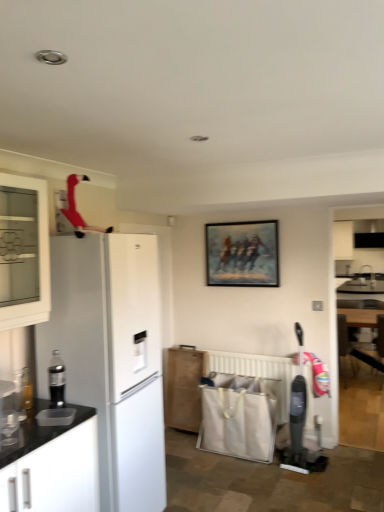
Describe the element at coordinates (183, 388) in the screenshot. I see `wooden cabinet at lower center, positioned as the second cabinetry in top-to-bottom order` at that location.

I want to click on black plastic soda dispenser at left, so click(56, 380).

Identify the location of wooden armchair at lower right. The image size is (384, 512). [353, 347].

What is the approximate width of white plastic radiator at lower center?

It is 1.45 inches.

What is the approximate width of white matte refrigerator at left?

white matte refrigerator at left is 26.10 inches in width.

In order to click on wooden cabinet at lower center, positioned as the second cabinetry in top-to-bottom order in this screenshot , I will do `click(183, 388)`.

Which of these two, white plastic radiator at lower center or white matte refrigerator at left, is wider?

white matte refrigerator at left.

From a real-world perspective, does white plastic radiator at lower center sit lower than white matte refrigerator at left?

Indeed, from a real-world perspective, white plastic radiator at lower center is positioned beneath white matte refrigerator at left.

Who is taller, white plastic radiator at lower center or white matte refrigerator at left?

white matte refrigerator at left.

How different are the orientations of white matte refrigerator at left and white plastic radiator at lower center in degrees?

white matte refrigerator at left and white plastic radiator at lower center are facing 90.7 degrees away from each other.

Would you say white matte refrigerator at left is a long distance from white plastic radiator at lower center?

Yes, white matte refrigerator at left and white plastic radiator at lower center are located far from each other.

Is white matte refrigerator at left outside of white plastic radiator at lower center?

Yes, white matte refrigerator at left is not within white plastic radiator at lower center.

Looking at the image, does black plastic soda dispenser at left seem bigger or smaller compared to white glass cabinet at left, the first cabinetry when ordered from left to right?

Clearly, black plastic soda dispenser at left is smaller in size than white glass cabinet at left, the first cabinetry when ordered from left to right.

Which object is thinner, black plastic soda dispenser at left or white glass cabinet at left, the 1th cabinetry when ordered from front to back?

Thinner between the two is black plastic soda dispenser at left.

Where is `appliance located on the right of white glass cabinet at left, which appears as the second cabinetry when viewed from the back`? appliance located on the right of white glass cabinet at left, which appears as the second cabinetry when viewed from the back is located at coordinates (56, 380).

Does black plastic soda dispenser at left touch white glass cabinet at left, which is counted as the second cabinetry, starting from the right?

There is a gap between black plastic soda dispenser at left and white glass cabinet at left, which is counted as the second cabinetry, starting from the right.

Looking at the image, does white plastic radiator at lower center seem bigger or smaller compared to wooden armchair at lower right?

In the image, white plastic radiator at lower center appears to be smaller than wooden armchair at lower right.

Consider the image. Which object is positioned more to the right, white plastic radiator at lower center or wooden armchair at lower right?

Positioned to the right is wooden armchair at lower right.

From the image's perspective, is white plastic radiator at lower center on top of wooden armchair at lower right?

No.

Which is behind, point (207, 357) or point (183, 370)?

The point (183, 370) is farther.

From a real-world perspective, which is physically above, white plastic radiator at lower center or wooden cabinet at lower center, which is counted as the second cabinetry, starting from the front?

In real-world perspective, white plastic radiator at lower center is above.

From the image's perspective, which is above, white plastic radiator at lower center or wooden cabinet at lower center, positioned as the second cabinetry in top-to-bottom order?

From the image's view, white plastic radiator at lower center is above.

In the scene shown: Relative to wooden cabinet at lower center, positioned as the second cabinetry in top-to-bottom order, is white plastic radiator at lower center in front or behind?

white plastic radiator at lower center is positioned closer to the viewer than wooden cabinet at lower center, positioned as the second cabinetry in top-to-bottom order.

Is black plastic soda dispenser at left beside wooden armchair at lower right?

No, black plastic soda dispenser at left is not beside wooden armchair at lower right.

From the image's perspective, does black plastic soda dispenser at left appear lower than wooden armchair at lower right?

No.

Is black plastic soda dispenser at left positioned behind wooden armchair at lower right?

No, black plastic soda dispenser at left is closer to the viewer.

From the image's perspective, between wooden armchair at lower right and white plastic radiator at lower center, which one is located above?

wooden armchair at lower right, from the image's perspective.

Is wooden armchair at lower right not inside white plastic radiator at lower center?

Absolutely, wooden armchair at lower right is external to white plastic radiator at lower center.

Is white plastic radiator at lower center at the back of wooden armchair at lower right?

Yes.

Based on the photo, in terms of height, does wooden armchair at lower right look taller or shorter compared to white plastic radiator at lower center?

Considering their sizes, wooden armchair at lower right has more height than white plastic radiator at lower center.

Find the location of a particular element. This screenshot has width=384, height=512. radiator below the white matte refrigerator at left (from the image's perspective) is located at coordinates (256, 372).

Identify the location of radiator that is behind the white matte refrigerator at left. (256, 372).

When comparing their distances from white glass cabinet at left, which appears as the second cabinetry when viewed from the back, does white plastic radiator at lower center or wooden cabinet at lower center, marked as the 2th cabinetry in a left-to-right arrangement, seem further?

Among the two, white plastic radiator at lower center is located further to white glass cabinet at left, which appears as the second cabinetry when viewed from the back.

Looking at the image, which one is located further to oil painting at center, wooden cabinet at lower center, which is counted as the second cabinetry, starting from the front, or white plastic radiator at lower center?

Based on the image, wooden cabinet at lower center, which is counted as the second cabinetry, starting from the front, appears to be further to oil painting at center.

Based on their spatial positions, is white glass cabinet at left, which appears as the second cabinetry when viewed from the back, or white plastic radiator at lower center closer to wooden armchair at lower right?

white plastic radiator at lower center is closer to wooden armchair at lower right.

Estimate the real-world distances between objects in this image. Which object is further from white matte refrigerator at left, oil painting at center or black plastic soda dispenser at left?

The object further to white matte refrigerator at left is oil painting at center.

Looking at the image, which one is located closer to white matte refrigerator at left, wooden cabinet at lower center, positioned as the second cabinetry in top-to-bottom order, or wooden armchair at lower right?

Based on the image, wooden cabinet at lower center, positioned as the second cabinetry in top-to-bottom order, appears to be nearer to white matte refrigerator at left.

Based on their spatial positions, is white glass cabinet at left, which appears as the 2th cabinetry when ordered from the bottom, or wooden armchair at lower right further from wooden cabinet at lower center, the 1th cabinetry from the right?

The object further to wooden cabinet at lower center, the 1th cabinetry from the right, is wooden armchair at lower right.

Based on their spatial positions, is white matte refrigerator at left or oil painting at center further from black plastic soda dispenser at left?

oil painting at center is further to black plastic soda dispenser at left.

Looking at the image, which one is located closer to wooden cabinet at lower center, the 1th cabinetry in the bottom-to-top sequence, black plastic soda dispenser at left or white matte refrigerator at left?

white matte refrigerator at left.

Locate an element on the screen. The image size is (384, 512). radiator between oil painting at center and wooden cabinet at lower center, the 1th cabinetry from the right, vertically is located at coordinates (256, 372).

Image resolution: width=384 pixels, height=512 pixels. Find the location of `appliance that lies between white glass cabinet at left, the first cabinetry when ordered from left to right, and white matte refrigerator at left from top to bottom`. appliance that lies between white glass cabinet at left, the first cabinetry when ordered from left to right, and white matte refrigerator at left from top to bottom is located at coordinates (56, 380).

This screenshot has width=384, height=512. Find the location of `refrigerator located between white glass cabinet at left, which is counted as the second cabinetry, starting from the right, and wooden cabinet at lower center, positioned as the second cabinetry in top-to-bottom order, in the depth direction`. refrigerator located between white glass cabinet at left, which is counted as the second cabinetry, starting from the right, and wooden cabinet at lower center, positioned as the second cabinetry in top-to-bottom order, in the depth direction is located at coordinates (112, 357).

In order to click on refrigerator located between white glass cabinet at left, which appears as the second cabinetry when viewed from the back, and oil painting at center in the depth direction in this screenshot , I will do `click(112, 357)`.